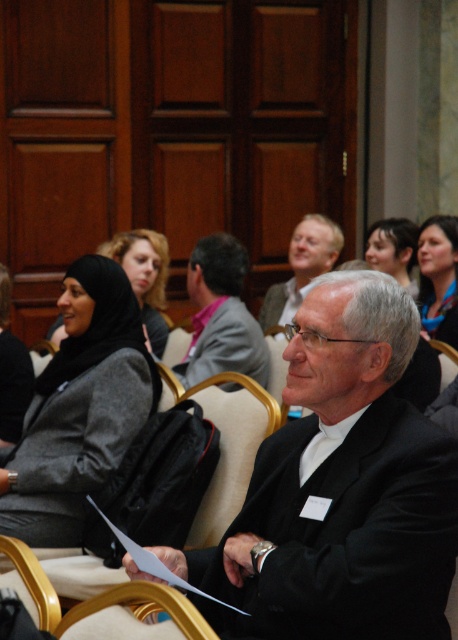
Consider the image. Is dark gray woolen jacket at left bigger than matte black hijab at upper left?

Yes, dark gray woolen jacket at left is bigger than matte black hijab at upper left.

Does dark gray woolen jacket at left appear over matte black hijab at upper left?

Incorrect, dark gray woolen jacket at left is not positioned above matte black hijab at upper left.

Locate an element on the screen. This screenshot has width=458, height=640. dark gray woolen jacket at left is located at coordinates (80, 408).

Between gray fabric jacket at center and smooth brown hair at upper right, which one has less height?

smooth brown hair at upper right is shorter.

Find the location of `gray fabric jacket at center`. gray fabric jacket at center is located at coordinates (222, 316).

Who is positioned more to the right, dark gray woolen jacket at left or matte black suit at center?

matte black suit at center is more to the right.

Is point (93, 413) positioned behind point (294, 252)?

No, (93, 413) is in front of (294, 252).

The image size is (458, 640). In order to click on dark gray woolen jacket at left in this screenshot , I will do (80, 408).